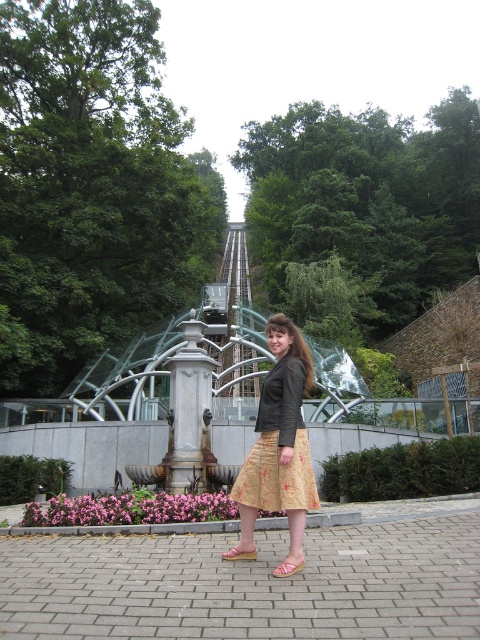
You are a photographer trying to capture a photo of the yellow floral skirt at center and the pink fabric sandal at center. Which object should you focus on first if you want to ensure both are in sharp focus, given that the skirt is taller than the sandal?

The yellow floral skirt at center is taller than the pink fabric sandal at center, so focusing on the yellow floral skirt at center first would ensure both are in sharp focus since it is the larger subject.

You are standing at the point marked by the coordinates point (279,442), which is where the yellow floral skirt at center is located. If you look directly ahead, what structure would you see in front of you?

The point (279,442) marks the yellow floral skirt at center, so looking directly ahead from there, you would see the decorative fountain or water feature with a tall cylindrical base in front of you.

You are standing on the walkway in the park and want to take a photo of the white marble fountain at center. To ensure the fountain is centered in your photo, where should you position yourself relative to the fountain?

To center the white marble fountain at center in your photo, you should position yourself directly in front of it along the walkway, aligning your camera with its central point at coordinates approximately 0.647 on the x and 0.394 on the y axis.